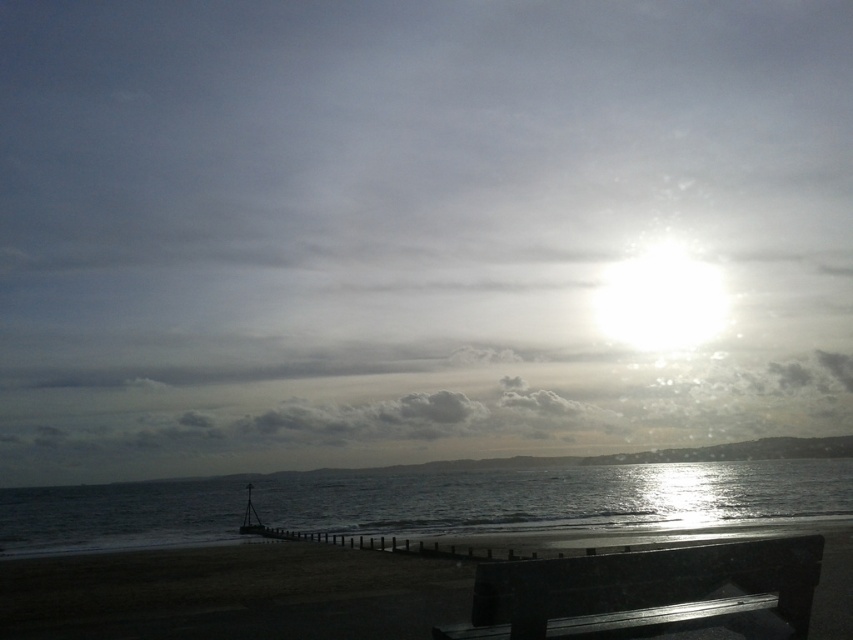
Measure the distance between shiny metallic water at lower center and black polished wood bench at lower center.

74.49 meters

Between shiny metallic water at lower center and black polished wood bench at lower center, which one is positioned higher?

black polished wood bench at lower center is above.

What do you see at coordinates (427, 502) in the screenshot? I see `shiny metallic water at lower center` at bounding box center [427, 502].

At what (x,y) coordinates should I click in order to perform the action: click on shiny metallic water at lower center. Please return your answer as a coordinate pair (x, y). Image resolution: width=853 pixels, height=640 pixels. Looking at the image, I should click on (427, 502).

Between point (282, 628) and point (502, 628), which one is positioned behind?

Positioned behind is point (282, 628).

Can you confirm if dark sand at lower center is positioned to the left of black polished wood bench at lower center?

Indeed, dark sand at lower center is positioned on the left side of black polished wood bench at lower center.

Between point (846, 550) and point (680, 595), which one is positioned behind?

Point (846, 550)

In order to click on dark sand at lower center in this screenshot , I will do pos(231,593).

Who is positioned more to the right, shiny metallic water at lower center or dark sand at lower center?

dark sand at lower center

Is point (846, 481) positioned behind point (99, 609)?

That is True.

This screenshot has height=640, width=853. Identify the location of shiny metallic water at lower center. (427, 502).